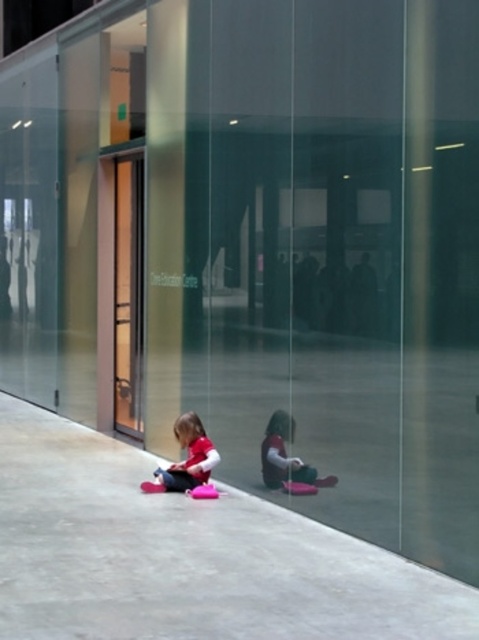
Question: Does concrete at lower center have a lesser width compared to matte pink fabric at lower center?

Choices:
 (A) yes
 (B) no

Answer: (B)

Question: Which object is closer to the camera taking this photo?

Choices:
 (A) concrete at lower center
 (B) matte pink fabric at lower center

Answer: (A)

Question: Which of the following is the farthest from the observer?

Choices:
 (A) (265, 467)
 (B) (36, 616)
 (C) (171, 476)

Answer: (C)

Question: Does concrete at lower center lie behind matte pink toy at lower center?

Choices:
 (A) no
 (B) yes

Answer: (A)

Question: Which point is farther to the camera?

Choices:
 (A) (312, 467)
 (B) (184, 448)

Answer: (B)

Question: Does matte pink fabric at lower center appear on the left side of matte pink toy at lower center?

Choices:
 (A) no
 (B) yes

Answer: (B)